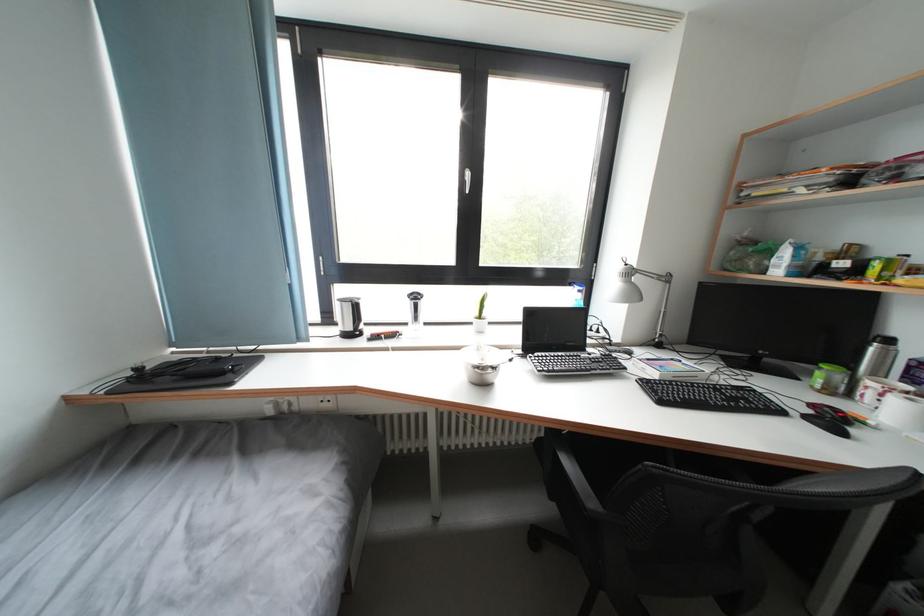
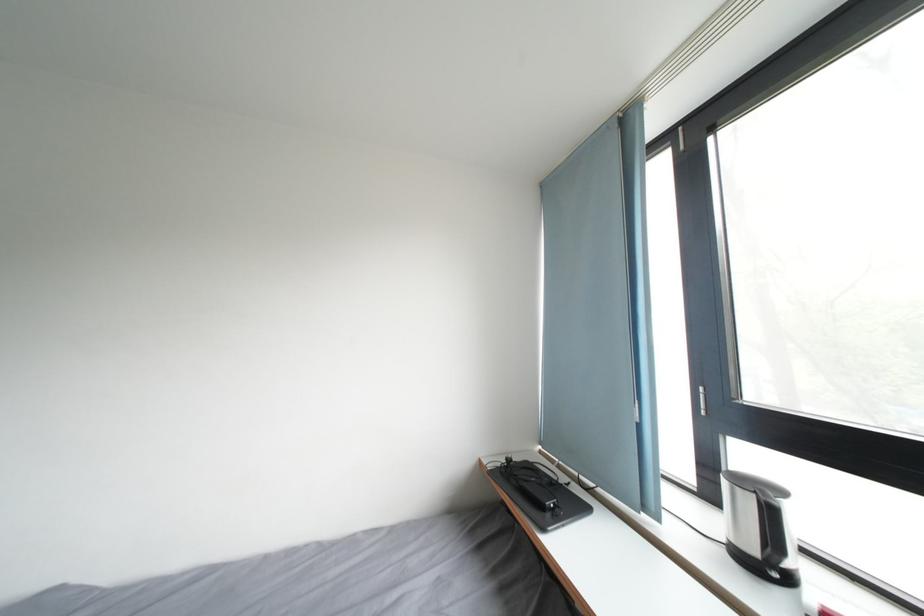
In the second image, find the point that corresponds to point (137, 379) in the first image.

(512, 467)